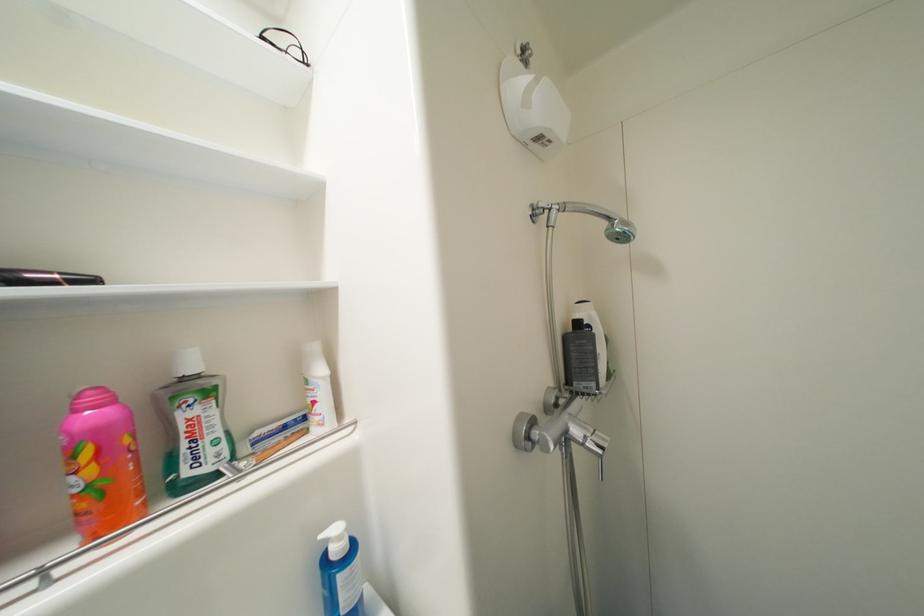
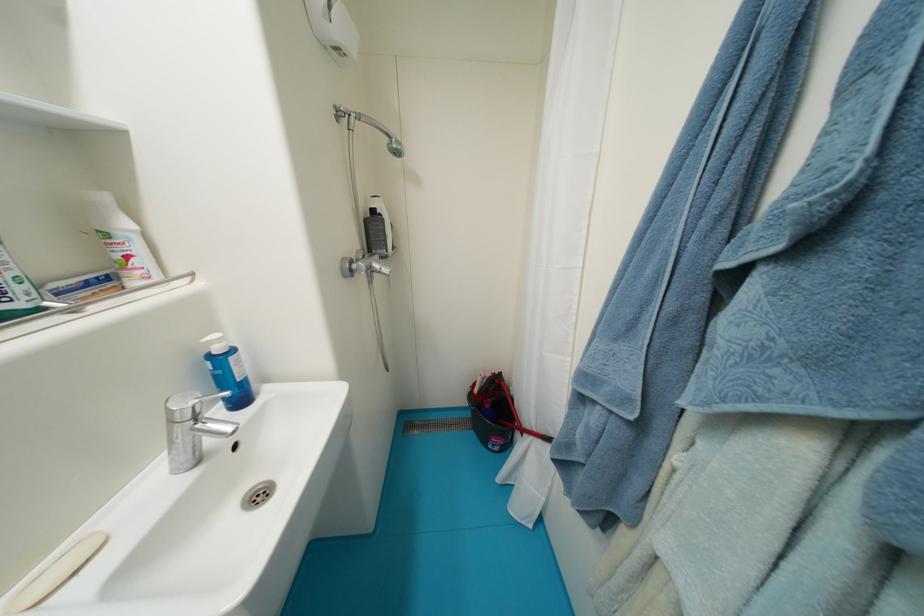
In the second image, find the point that corresponds to (321,405) in the first image.

(134, 259)